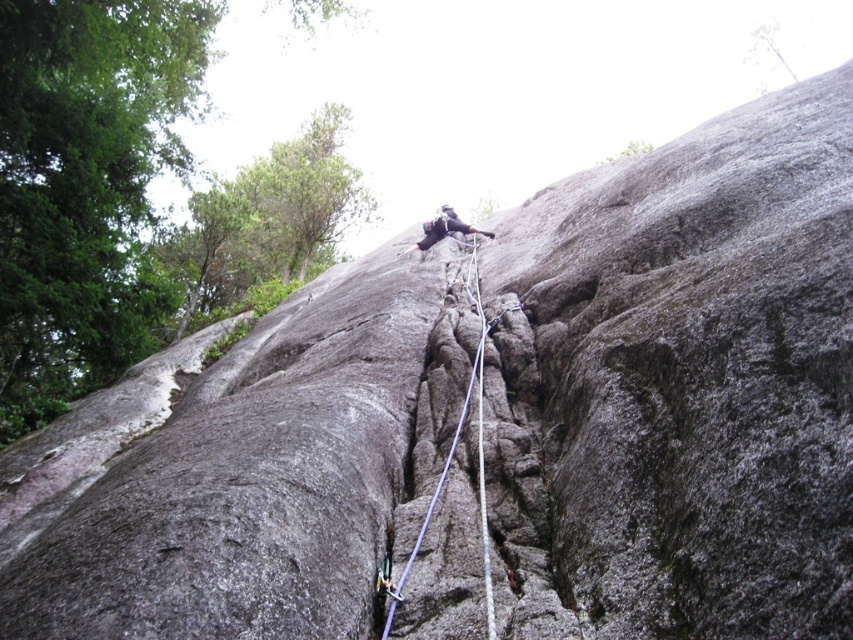
You are a safety inspector checking the climbing setup. The purple nylon rope at center and the dark gray climbing gear at center are both in use. Which object has a smaller width?

The purple nylon rope at center has a smaller width than the dark gray climbing gear at center.